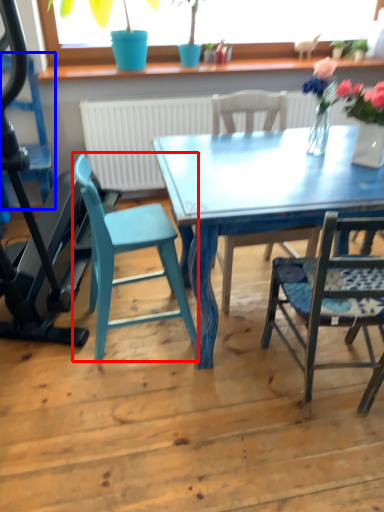
Question: Which object is further to the camera taking this photo, chair (highlighted by a red box) or chair (highlighted by a blue box)?

Choices:
 (A) chair
 (B) chair

Answer: (B)